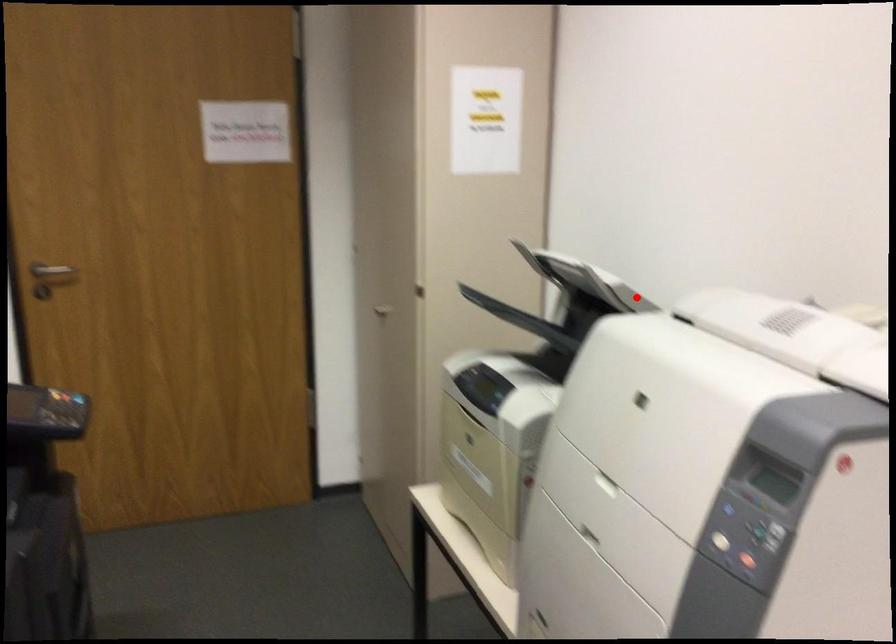
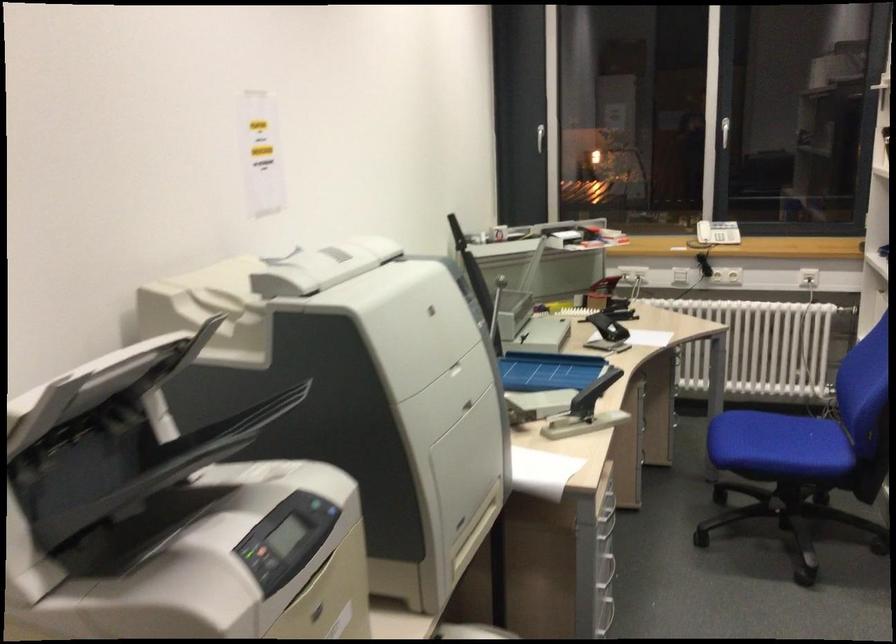
Question: I am providing you with two images of the same scene from different viewpoints. Image1 has a red point marked. In image2, the corresponding 3D location appears at what relative position? Reply with the corresponding letter.

Choices:
 (A) Closer
 (B) Farther

Answer: (A)